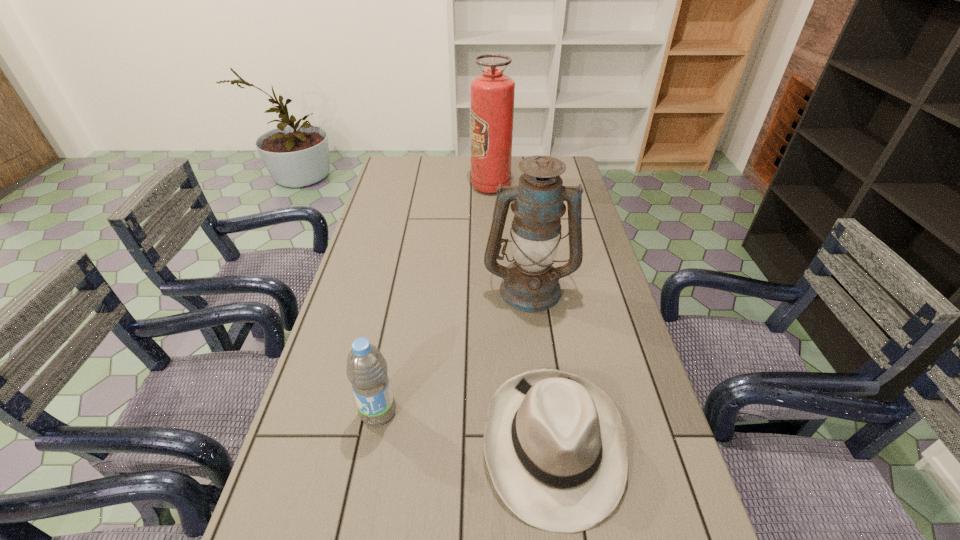
Where is `free area in between the fire extinguisher and the third nearest object`? The image size is (960, 540). free area in between the fire extinguisher and the third nearest object is located at coordinates (511, 237).

In order to click on vacant space that's between the shortest object and the oil lamp in this screenshot , I will do `click(541, 366)`.

Find the location of a particular element. This screenshot has width=960, height=540. free area in between the oil lamp and the leftmost object is located at coordinates (454, 350).

Identify the location of vacant space in between the farthest object and the third nearest object. The height and width of the screenshot is (540, 960). (511, 237).

This screenshot has width=960, height=540. What are the coordinates of `empty location between the farthest object and the fedora` in the screenshot? It's located at (522, 315).

Where is `unoccupied area between the farthest object and the third nearest object`? The image size is (960, 540). unoccupied area between the farthest object and the third nearest object is located at coordinates (511, 237).

In order to click on object that can be found as the closest to the fedora in this screenshot , I will do `click(367, 369)`.

You are a GUI agent. You are given a task and a screenshot of the screen. Output one action in this format:
    pyautogui.click(x=<x>, y=<y>)
    Task: Click on the second closest object relative to the farthest object
    This screenshot has width=960, height=540.
    Given the screenshot: What is the action you would take?
    pyautogui.click(x=555, y=445)